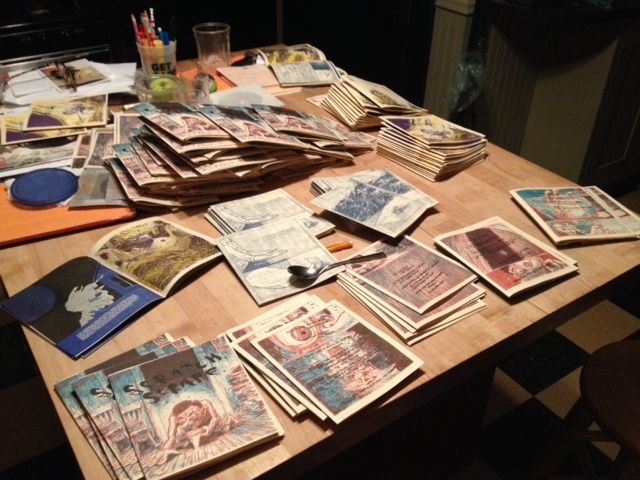
Identify the location of pile of paper books. (278, 134), (216, 129), (189, 150).